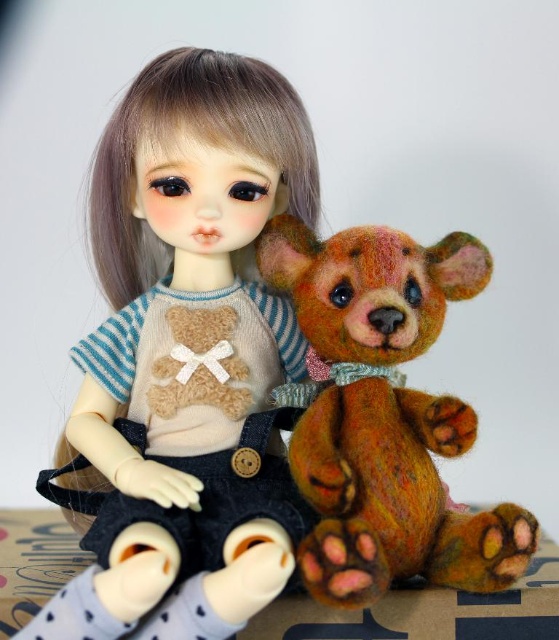
Question: Which of the following is the farthest from the observer?

Choices:
 (A) textured brown bear at center
 (B) matte beige doll at center

Answer: (A)

Question: Is matte beige doll at center in front of textured brown bear at center?

Choices:
 (A) no
 (B) yes

Answer: (B)

Question: Does matte beige doll at center appear on the left side of textured brown bear at center?

Choices:
 (A) no
 (B) yes

Answer: (B)

Question: Can you confirm if matte beige doll at center is thinner than textured brown bear at center?

Choices:
 (A) no
 (B) yes

Answer: (A)